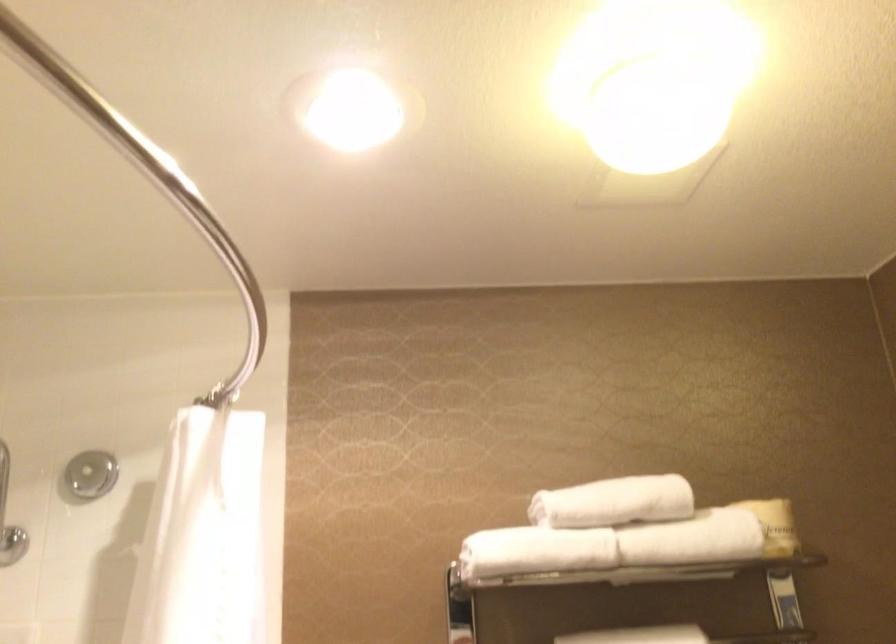
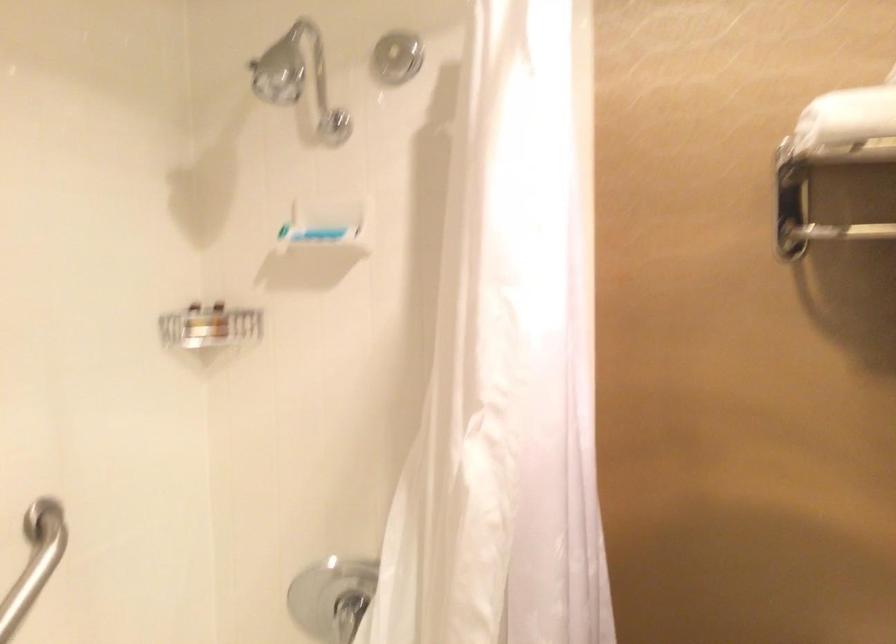
Based on the continuous images, in which direction is the camera rotating?

The camera's rotation is toward left-down.